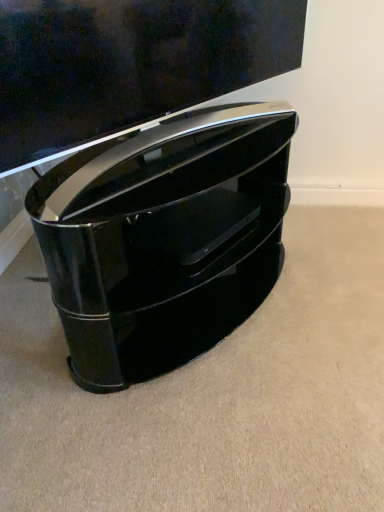
Where is `free space below glossy black tv stand at lower center (from a real-world perspective)`? The width and height of the screenshot is (384, 512). free space below glossy black tv stand at lower center (from a real-world perspective) is located at coordinates (179, 151).